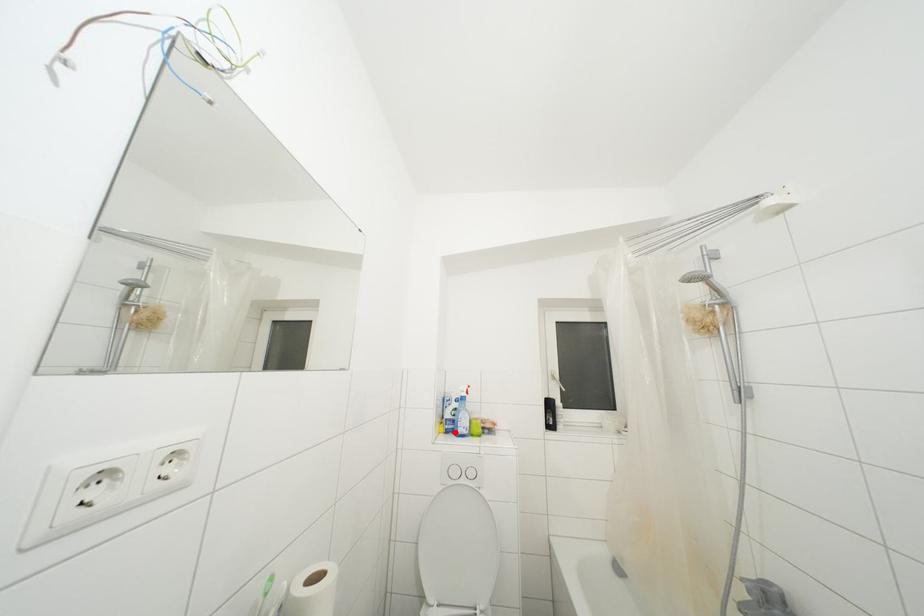
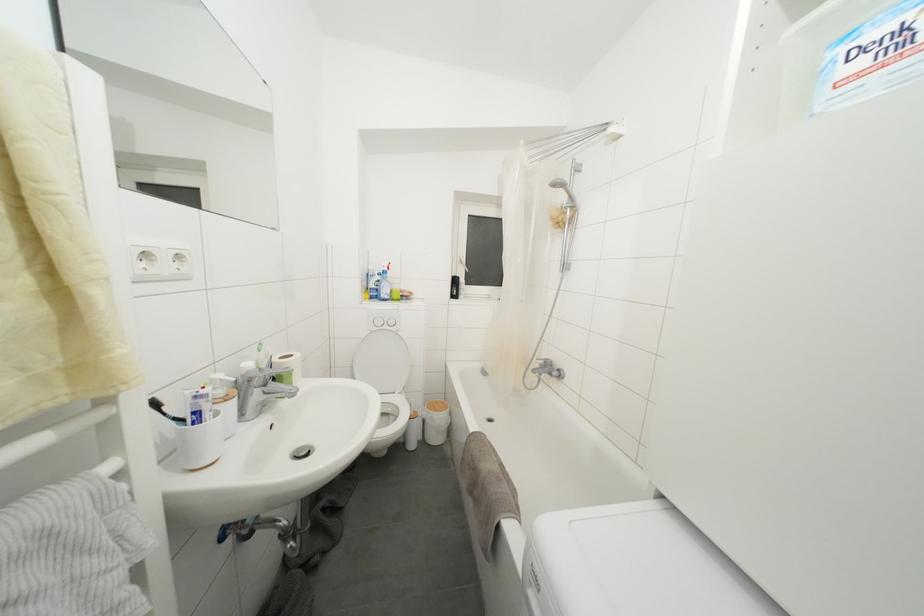
Question: I am providing you with two images of the same scene from different viewpoints. Image1 has a red point marked. In image2, the corresponding 3D location appears at what relative position? Reply with the corresponding letter.

Choices:
 (A) Closer
 (B) Farther

Answer: (A)